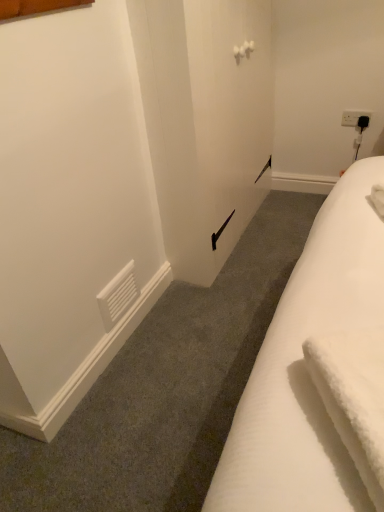
Question: From their relative heights in the image, would you say white fluffy bath towel at lower right is taller or shorter than white plastic electric outlet at upper right?

Choices:
 (A) tall
 (B) short

Answer: (A)

Question: Is white fluffy bath towel at lower right inside the boundaries of white plastic electric outlet at upper right, or outside?

Choices:
 (A) inside
 (B) outside

Answer: (B)

Question: In terms of size, does white fluffy bath towel at lower right appear bigger or smaller than white plastic electric outlet at upper right?

Choices:
 (A) big
 (B) small

Answer: (A)

Question: Is white plastic electric outlet at upper right inside the boundaries of white fluffy bath towel at lower right, or outside?

Choices:
 (A) outside
 (B) inside

Answer: (A)

Question: Considering the positions of point (370, 115) and point (380, 492), is point (370, 115) closer or farther from the camera than point (380, 492)?

Choices:
 (A) closer
 (B) farther

Answer: (B)

Question: From the image's perspective, is white plastic electric outlet at upper right positioned above or below white fluffy bath towel at lower right?

Choices:
 (A) below
 (B) above

Answer: (B)

Question: From a real-world perspective, relative to white fluffy bath towel at lower right, is white plastic electric outlet at upper right vertically above or below?

Choices:
 (A) below
 (B) above

Answer: (A)